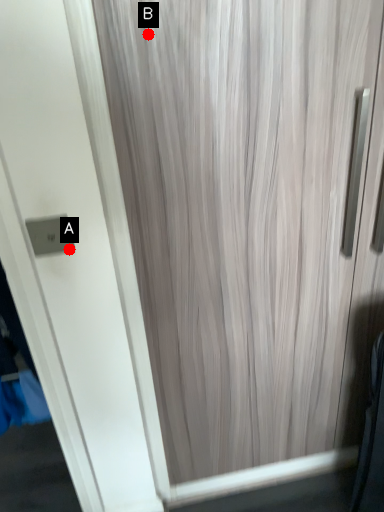
Question: Two points are circled on the image, labeled by A and B beside each circle. Which point is further to the camera?

Choices:
 (A) A is further
 (B) B is further

Answer: (A)